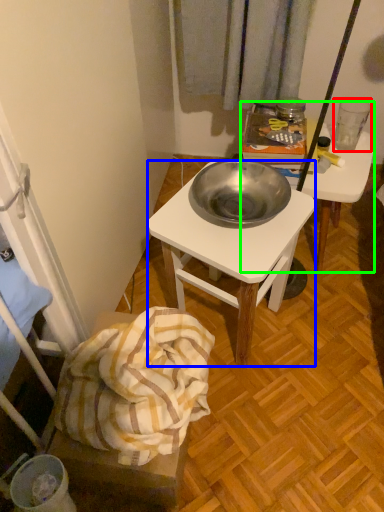
Question: Which object is positioned farthest from coffee cup (highlighted by a red box)? Select from desk (highlighted by a blue box) and desk (highlighted by a green box).

Choices:
 (A) desk
 (B) desk

Answer: (A)